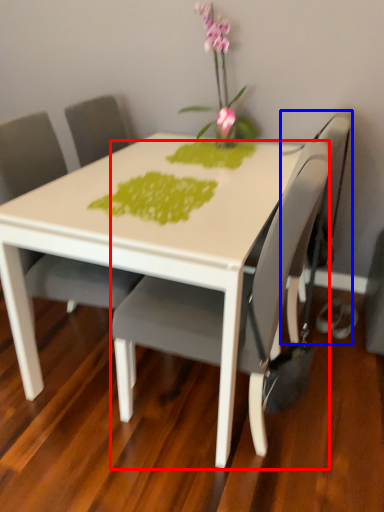
Question: Which object is further to the camera taking this photo, chair (highlighted by a red box) or swivel chair (highlighted by a blue box)?

Choices:
 (A) chair
 (B) swivel chair

Answer: (B)